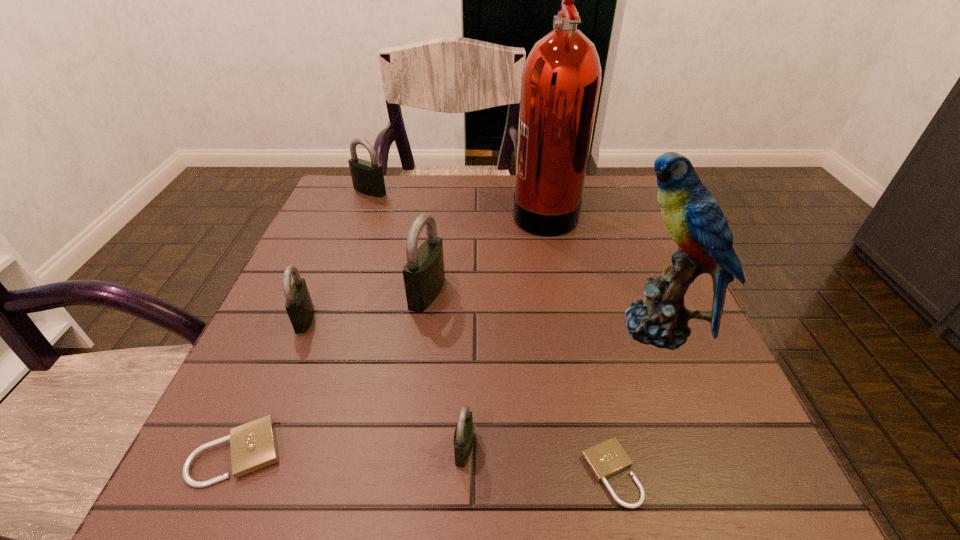
The height and width of the screenshot is (540, 960). Identify the location of free space located on the face of the second tallest object. (527, 327).

Locate an element on the screen. vacant region located on the face of the second tallest object is located at coordinates (543, 327).

Locate an element on the screen. This screenshot has height=540, width=960. free region located 0.380m on the right of the third padlock from right to left is located at coordinates (633, 293).

Find the location of `vacant position located 0.160m on the right of the farthest black padlock`. vacant position located 0.160m on the right of the farthest black padlock is located at coordinates (446, 191).

This screenshot has width=960, height=540. Find the location of `vacant space located 0.230m on the back of the fourth shortest object`. vacant space located 0.230m on the back of the fourth shortest object is located at coordinates (339, 235).

The height and width of the screenshot is (540, 960). Identify the location of free spot located 0.240m on the back of the rightmost black padlock. (468, 314).

At what (x,y) coordinates should I click in order to perform the action: click on vacant region located 0.360m on the back of the seventh tallest object. Please return your answer as a coordinate pair (x, y). The width and height of the screenshot is (960, 540). Looking at the image, I should click on (318, 269).

Find the location of a particular element. The height and width of the screenshot is (540, 960). blank space located 0.090m on the right of the shortest object is located at coordinates (704, 474).

This screenshot has width=960, height=540. In order to click on fire extinguisher located in the far edge section of the desktop in this screenshot , I will do `click(561, 78)`.

The height and width of the screenshot is (540, 960). What are the coordinates of `padlock that is at the far edge` in the screenshot? It's located at (367, 177).